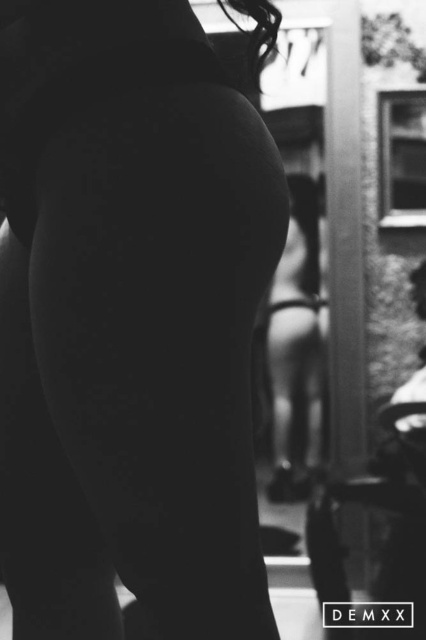
Is smooth skin at center shorter than smooth skin girl at center?

Yes, smooth skin at center is shorter than smooth skin girl at center.

Is smooth skin at center to the left of smooth skin girl at center from the viewer's perspective?

Correct, you'll find smooth skin at center to the left of smooth skin girl at center.

Where is `smooth skin at center`? The width and height of the screenshot is (426, 640). smooth skin at center is located at coordinates (129, 321).

Image resolution: width=426 pixels, height=640 pixels. In order to click on smooth skin at center in this screenshot , I will do `click(129, 321)`.